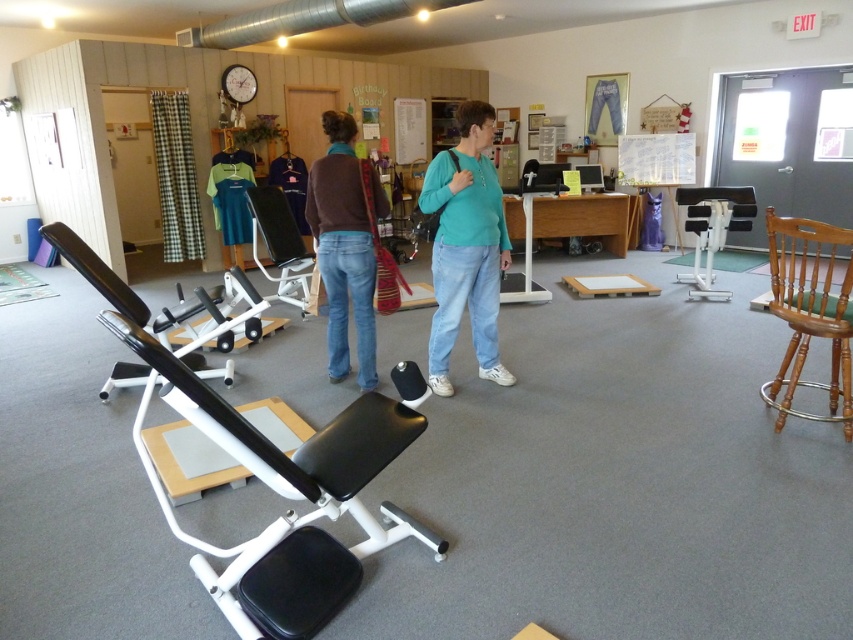
You are setting up a fitness class and need to move the black plastic exercise bench at center to the right side of the room. However, there is a gray carpet in the way. Can you move the bench around the black matte bench at left?

The black matte bench at left is located below the black plastic exercise bench at center, meaning they are stacked or positioned vertically. Since they are not on the same level, you can move the black plastic exercise bench at center around the black matte bench at left without obstruction.

You are standing at the entrance of the community center and want to move towards the point labeled point [851,273]. There is an obstacle at point [276,230]. Will you pass in front of or behind the obstacle?

Since point [851,273] is in front of point [276,230], you will pass in front of the obstacle at point [276,230] on your way to point [851,273].

You are organizing a birthday party in this room and need to seat guests. The light brown wooden chair at right and the black plastic exercise bench at center are available. Which one can accommodate more people if you have to seat 5 guests?

The light brown wooden chair at right has a larger size compared to the black plastic exercise bench at center, so it can accommodate more people for seating 5 guests.